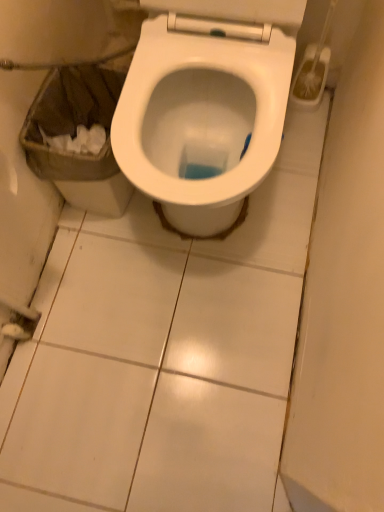
Locate an element on the screen. white glossy toilet at center is located at coordinates (75, 135).

What do you see at coordinates (75, 135) in the screenshot?
I see `white glossy toilet at center` at bounding box center [75, 135].

Locate an element on the screen. white glossy toilet at center is located at coordinates tap(75, 135).